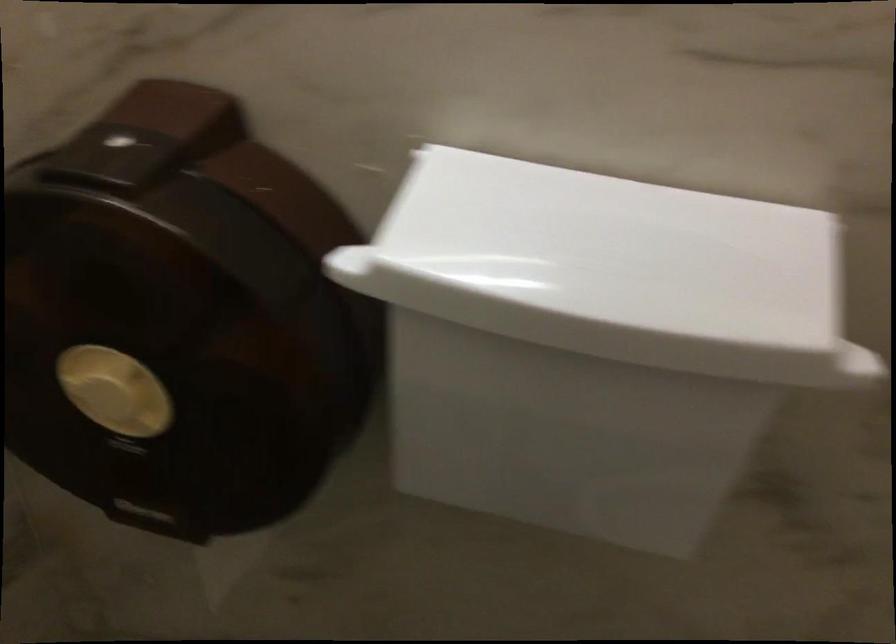
Find where to push the dispenser dial. Please return your answer as a coordinate pair (x, y).

(115, 393)